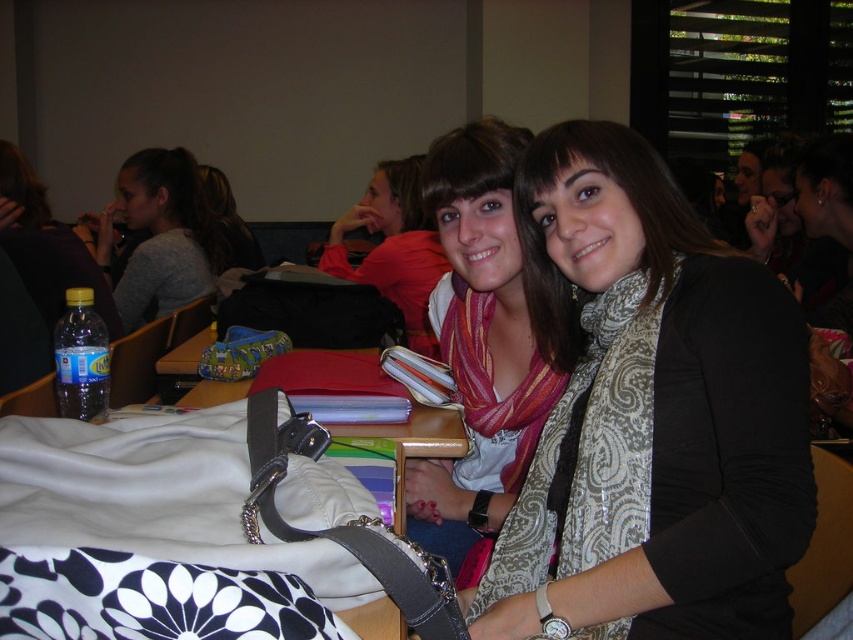
Looking at this image, does matte pink scarf at center appear under matte red sweater at center?

Yes.

Is matte pink scarf at center smaller than matte red sweater at center?

Yes, matte pink scarf at center is smaller than matte red sweater at center.

Which is in front, point (454, 225) or point (399, 186)?

Point (454, 225) is more forward.

At what (x,y) coordinates should I click in order to perform the action: click on matte pink scarf at center. Please return your answer as a coordinate pair (x, y). The width and height of the screenshot is (853, 640). Looking at the image, I should click on (479, 348).

Does matte pink scarf at center come behind gray sweater at left?

No, matte pink scarf at center is closer to the viewer.

Is point (476, 278) closer to camera compared to point (196, 289)?

Yes.

You are a GUI agent. You are given a task and a screenshot of the screen. Output one action in this format:
    pyautogui.click(x=<x>, y=<y>)
    Task: Click on the matte pink scarf at center
    
    Given the screenshot: What is the action you would take?
    pyautogui.click(x=479, y=348)

Can you confirm if gray sweater at left is shorter than matte red sweater at center?

Incorrect, gray sweater at left's height does not fall short of matte red sweater at center's.

Is gray sweater at left wider than matte red sweater at center?

Correct, the width of gray sweater at left exceeds that of matte red sweater at center.

What do you see at coordinates (160, 236) in the screenshot?
I see `gray sweater at left` at bounding box center [160, 236].

The width and height of the screenshot is (853, 640). Identify the location of gray sweater at left. (160, 236).